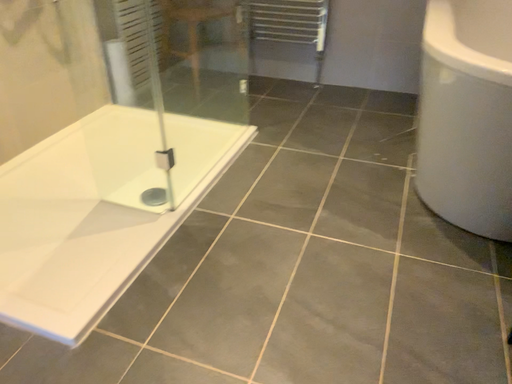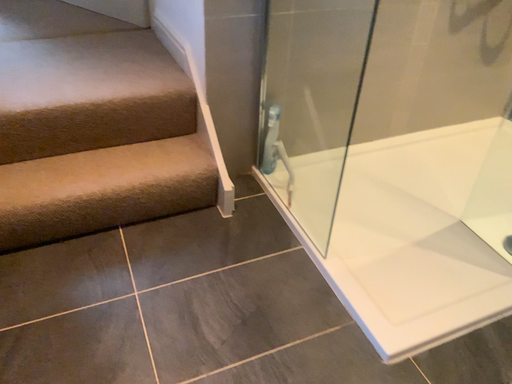
Question: How did the camera likely rotate when shooting the video?

Choices:
 (A) rotated downward
 (B) rotated upward

Answer: (B)